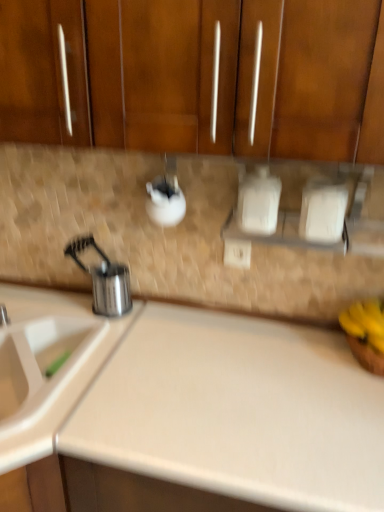
The height and width of the screenshot is (512, 384). Describe the element at coordinates (47, 365) in the screenshot. I see `white plastic sink at lower left` at that location.

At what (x,y) coordinates should I click in order to perform the action: click on brushed metal tap at left. Please return your answer as a coordinate pair (x, y). The width and height of the screenshot is (384, 512). Looking at the image, I should click on (4, 316).

What is the approximate width of yellow matte bananas at right?

yellow matte bananas at right is 8.61 inches in width.

The width and height of the screenshot is (384, 512). Find the location of `white plastic electric outlet at center`. white plastic electric outlet at center is located at coordinates (237, 253).

Locate an element on the screen. white plastic sink at lower left is located at coordinates (47, 365).

Is beige laminate counter top at center closer to camera compared to stainless steel utensil holder at left?

Yes, the depth of beige laminate counter top at center is less than that of stainless steel utensil holder at left.

Is beige laminate counter top at center smaller than stainless steel utensil holder at left?

Actually, beige laminate counter top at center might be larger than stainless steel utensil holder at left.

How far apart are beige laminate counter top at center and stainless steel utensil holder at left?

The distance of beige laminate counter top at center from stainless steel utensil holder at left is 18.23 inches.

From the image's perspective, which is below, white plastic electric outlet at center or yellow matte bananas at right?

yellow matte bananas at right, from the image's perspective.

Considering the relative positions of white plastic electric outlet at center and yellow matte bananas at right in the image provided, is white plastic electric outlet at center in front of yellow matte bananas at right?

No, white plastic electric outlet at center is further to the viewer.

From the image's perspective, does yellow matte bananas at right appear higher than white plastic sink at lower left?

Yes.

Identify the location of sink to the left of yellow matte bananas at right. The height and width of the screenshot is (512, 384). (47, 365).

Is yellow matte bananas at right at the right side of white plastic sink at lower left?

Indeed, yellow matte bananas at right is positioned on the right side of white plastic sink at lower left.

Considering the relative sizes of white plastic sink at lower left and stainless steel utensil holder at left in the image provided, is white plastic sink at lower left smaller than stainless steel utensil holder at left?

No.

Based on the photo, considering the relative sizes of white plastic sink at lower left and stainless steel utensil holder at left in the image provided, is white plastic sink at lower left shorter than stainless steel utensil holder at left?

Incorrect, the height of white plastic sink at lower left does not fall short of that of stainless steel utensil holder at left.

Between white plastic sink at lower left and stainless steel utensil holder at left, which one has smaller width?

With smaller width is stainless steel utensil holder at left.

Which is more to the left, white plastic sink at lower left or stainless steel utensil holder at left?

From the viewer's perspective, white plastic sink at lower left appears more on the left side.

From the image's perspective, does brushed metal tap at left appear lower than stainless steel utensil holder at left?

Yes, from the image's perspective, brushed metal tap at left is beneath stainless steel utensil holder at left.

I want to click on appliance located above the brushed metal tap at left (from the image's perspective), so click(104, 279).

Is brushed metal tap at left smaller than stainless steel utensil holder at left?

Yes.

Considering the positions of objects brushed metal tap at left and stainless steel utensil holder at left in the image provided, who is behind, brushed metal tap at left or stainless steel utensil holder at left?

brushed metal tap at left is more distant.

Is point (3, 297) farther from viewer compared to point (245, 250)?

Yes, it is behind point (245, 250).

Considering the sizes of white plastic sink at lower left and white plastic electric outlet at center in the image, is white plastic sink at lower left wider or thinner than white plastic electric outlet at center?

In the image, white plastic sink at lower left appears to be wider than white plastic electric outlet at center.

Is white plastic sink at lower left bigger or smaller than white plastic electric outlet at center?

Considering their sizes, white plastic sink at lower left takes up more space than white plastic electric outlet at center.

Which object is positioned more to the right, white plastic sink at lower left or white plastic electric outlet at center?

Positioned to the right is white plastic electric outlet at center.

Consider the image. Is brushed metal tap at left bigger or smaller than yellow matte bananas at right?

brushed metal tap at left is smaller than yellow matte bananas at right.

Do you think brushed metal tap at left is within yellow matte bananas at right, or outside of it?

brushed metal tap at left is located beyond the bounds of yellow matte bananas at right.

Identify the location of counter top below the stainless steel utensil holder at left (from the image's perspective). (237, 411).

Find the location of a particular element. The image size is (384, 512). banana in front of the white plastic electric outlet at center is located at coordinates (365, 322).

Looking at the image, which one is located closer to white plastic sink at lower left, white plastic electric outlet at center or beige laminate counter top at center?

The object closer to white plastic sink at lower left is beige laminate counter top at center.

Looking at the image, which one is located further to beige laminate counter top at center, stainless steel utensil holder at left or yellow matte bananas at right?

stainless steel utensil holder at left.

Estimate the real-world distances between objects in this image. Which object is closer to yellow matte bananas at right, beige laminate counter top at center or white plastic sink at lower left?

The object closer to yellow matte bananas at right is beige laminate counter top at center.

When comparing their distances from yellow matte bananas at right, does beige laminate counter top at center or white plastic electric outlet at center seem closer?

Based on the image, beige laminate counter top at center appears to be nearer to yellow matte bananas at right.

From the image, which object appears to be nearer to white plastic sink at lower left, stainless steel utensil holder at left or yellow matte bananas at right?

Based on the image, stainless steel utensil holder at left appears to be nearer to white plastic sink at lower left.

Estimate the real-world distances between objects in this image. Which object is closer to beige laminate counter top at center, yellow matte bananas at right or white plastic electric outlet at center?

The object closer to beige laminate counter top at center is yellow matte bananas at right.

From the image, which object appears to be nearer to white plastic sink at lower left, stainless steel utensil holder at left or brushed metal tap at left?

stainless steel utensil holder at left lies closer to white plastic sink at lower left than the other object.

When comparing their distances from stainless steel utensil holder at left, does beige laminate counter top at center or white plastic electric outlet at center seem closer?

The object closer to stainless steel utensil holder at left is white plastic electric outlet at center.

At what (x,y) coordinates should I click in order to perform the action: click on banana between white plastic electric outlet at center and beige laminate counter top at center vertically. Please return your answer as a coordinate pair (x, y). This screenshot has height=512, width=384. Looking at the image, I should click on (365, 322).

This screenshot has height=512, width=384. Identify the location of electric outlet located between brushed metal tap at left and beige laminate counter top at center in the left-right direction. [237, 253].

You are a GUI agent. You are given a task and a screenshot of the screen. Output one action in this format:
    pyautogui.click(x=<x>, y=<y>)
    Task: Click on the tap between white plastic sink at lower left and beige laminate counter top at center from left to right
    The image size is (384, 512).
    Given the screenshot: What is the action you would take?
    pyautogui.click(x=4, y=316)

Where is `electric outlet between white plastic sink at lower left and beige laminate counter top at center from left to right`? Image resolution: width=384 pixels, height=512 pixels. electric outlet between white plastic sink at lower left and beige laminate counter top at center from left to right is located at coordinates (237, 253).